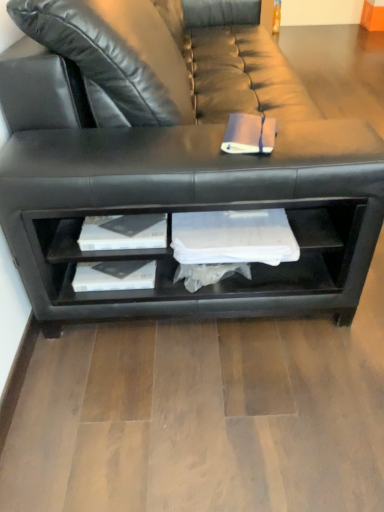
Question: Is black leather couch at center far from pink matte book at center?

Choices:
 (A) yes
 (B) no

Answer: (B)

Question: Is black leather couch at center positioned behind pink matte book at center?

Choices:
 (A) no
 (B) yes

Answer: (A)

Question: From the image's perspective, is black leather couch at center located above pink matte book at center?

Choices:
 (A) no
 (B) yes

Answer: (B)

Question: Does black leather couch at center touch pink matte book at center?

Choices:
 (A) yes
 (B) no

Answer: (B)

Question: Considering the relative sizes of black leather couch at center and pink matte book at center in the image provided, is black leather couch at center smaller than pink matte book at center?

Choices:
 (A) yes
 (B) no

Answer: (B)

Question: From the image's perspective, is black leather couch at center located beneath pink matte book at center?

Choices:
 (A) no
 (B) yes

Answer: (A)

Question: Is there a large distance between pink matte book at center and black leather couch at center?

Choices:
 (A) no
 (B) yes

Answer: (A)

Question: Can you confirm if pink matte book at center is shorter than black leather couch at center?

Choices:
 (A) no
 (B) yes

Answer: (B)

Question: From the image's perspective, would you say pink matte book at center is positioned over black leather couch at center?

Choices:
 (A) yes
 (B) no

Answer: (B)

Question: Is pink matte book at center outside black leather couch at center?

Choices:
 (A) no
 (B) yes

Answer: (A)

Question: Is pink matte book at center in contact with black leather couch at center?

Choices:
 (A) no
 (B) yes

Answer: (A)

Question: Considering the relative sizes of pink matte book at center and black leather couch at center in the image provided, is pink matte book at center taller than black leather couch at center?

Choices:
 (A) no
 (B) yes

Answer: (A)

Question: From their relative heights in the image, would you say pink matte book at center is taller or shorter than black leather couch at center?

Choices:
 (A) tall
 (B) short

Answer: (B)